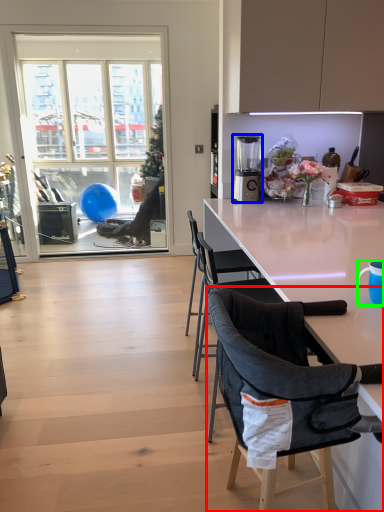
Question: Which object is positioned closest to chair (highlighted by a red box)? Select from blender (highlighted by a blue box) and coffee cup (highlighted by a green box).

Choices:
 (A) blender
 (B) coffee cup

Answer: (B)